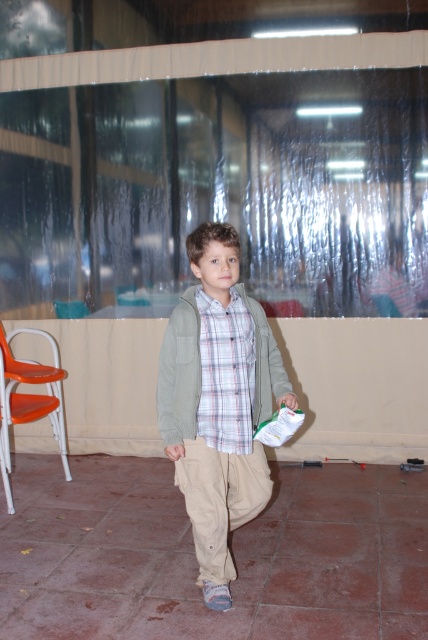
Based on the photo, the young boy is carrying a small bag in his right hand. Which item is positioned to the right of the other between the light brown cotton pants at center and the green matte jacket at center?

The light brown cotton pants at center are to the right of the green matte jacket at center.

The boy is walking through a narrow doorway that is 1.2 meters wide. Based on the image, can his light brown cotton pants at center and green matte jacket at center both fit through the doorway without needing to adjust his clothing?

The light brown cotton pants at center might be wider than green matte jacket at center, so there is a possibility that the total width of both items could exceed the doorway width of 1.2 meters. The boy may need to adjust his clothing to ensure they both fit through the doorway.

The boy is holding a small bag in his right hand and wearing a green matte jacket at center. If the bag is 0.2 meters wide, can he place it on a shelf that is 0.3 meters wide without it hanging off?

The bag is 0.2 meters wide, which is narrower than the shelf that is 0.3 meters wide, so it will fit without hanging off.